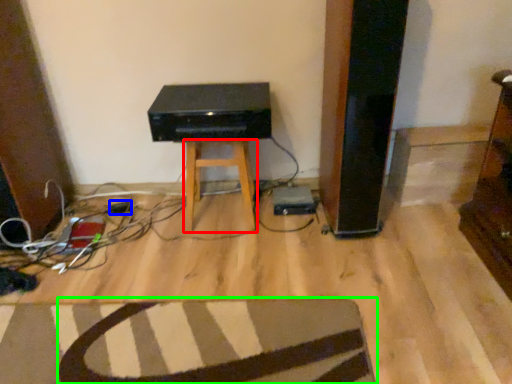
Question: Considering the real-world distances, which object is farthest from stool (highlighted by a red box)? plug (highlighted by a blue box) or furniture (highlighted by a green box)?

Choices:
 (A) plug
 (B) furniture

Answer: (B)